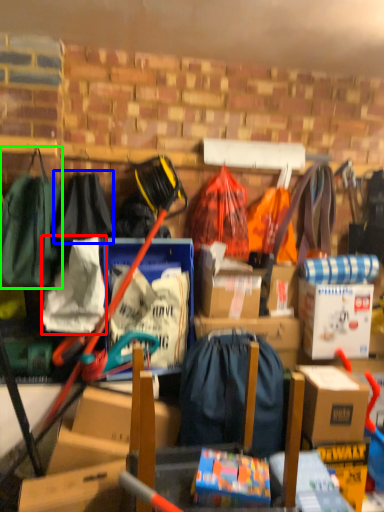
Question: Which is nearer to the clothing (highlighted by a red box)? clothing (highlighted by a blue box) or clothing (highlighted by a green box).

Choices:
 (A) clothing
 (B) clothing

Answer: (B)